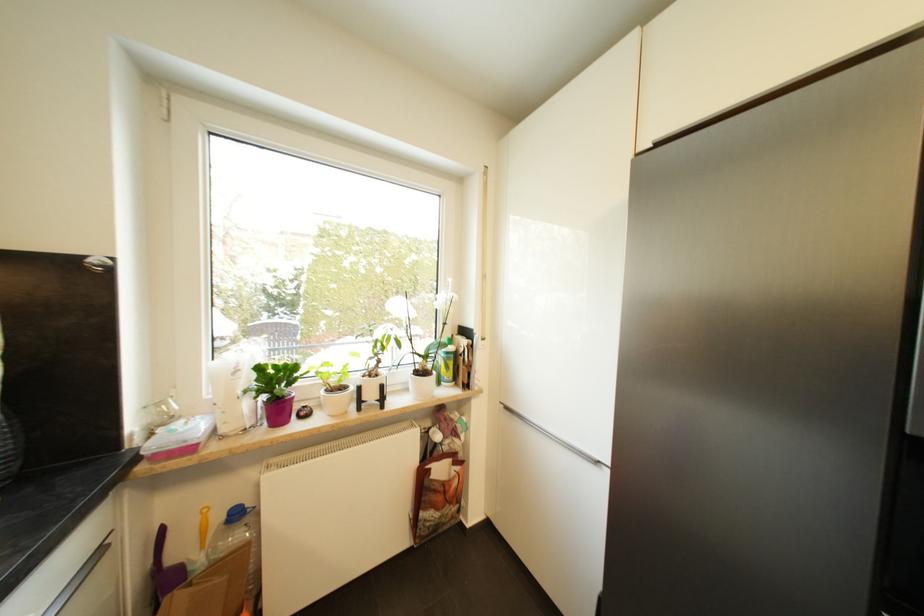
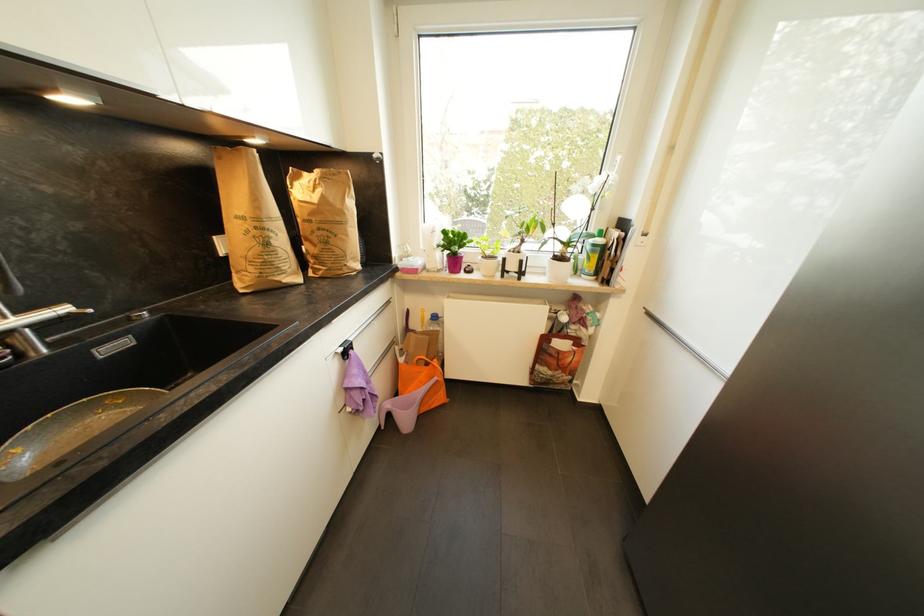
Where in the second image is the point corresponding to [241,517] from the first image?

(440, 320)